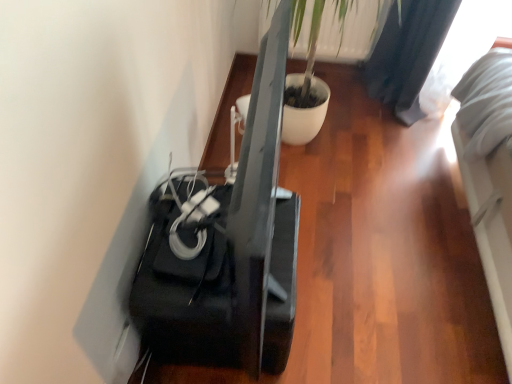
Question: From a real-world perspective, is black glossy speaker at lower left positioned above or below green leafy plant at upper center?

Choices:
 (A) below
 (B) above

Answer: (A)

Question: From the image's perspective, is black glossy speaker at lower left located above or below green leafy plant at upper center?

Choices:
 (A) above
 (B) below

Answer: (B)

Question: In the image, is black glossy speaker at lower left positioned in front of or behind green leafy plant at upper center?

Choices:
 (A) behind
 (B) front

Answer: (B)

Question: Looking at their shapes, would you say green leafy plant at upper center is wider or thinner than black glossy speaker at lower left?

Choices:
 (A) thin
 (B) wide

Answer: (A)

Question: In terms of height, does green leafy plant at upper center look taller or shorter compared to black glossy speaker at lower left?

Choices:
 (A) short
 (B) tall

Answer: (A)

Question: Is green leafy plant at upper center to the left or to the right of black glossy speaker at lower left in the image?

Choices:
 (A) right
 (B) left

Answer: (A)

Question: From a real-world perspective, is green leafy plant at upper center physically located above or below black glossy speaker at lower left?

Choices:
 (A) above
 (B) below

Answer: (A)